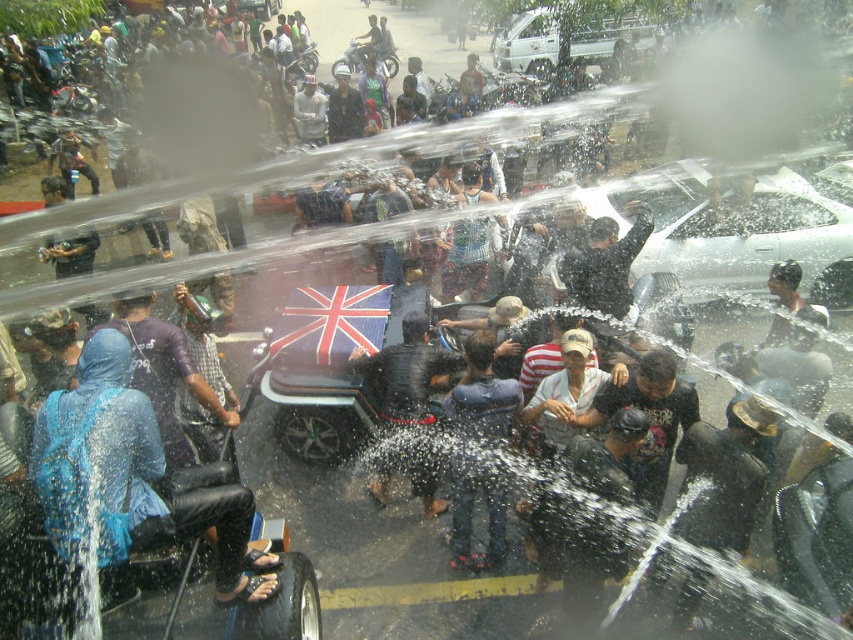
Question: Is blue fabric umbrella at left thinner than dark blue jeans at center?

Choices:
 (A) no
 (B) yes

Answer: (A)

Question: Is blue fabric umbrella at left to the left of dark blue jeans at center from the viewer's perspective?

Choices:
 (A) yes
 (B) no

Answer: (A)

Question: Is blue fabric umbrella at left thinner than dark blue jeans at center?

Choices:
 (A) no
 (B) yes

Answer: (A)

Question: Which object is farther from the camera taking this photo?

Choices:
 (A) blue fabric umbrella at left
 (B) dark blue fabric umbrella at center
 (C) dark blue jeans at center

Answer: (B)

Question: Among these points, which one is farthest from the camera?

Choices:
 (A) (370, 493)
 (B) (119, 484)
 (C) (473, 376)

Answer: (A)

Question: Which point is farther to the camera?

Choices:
 (A) dark blue fabric umbrella at center
 (B) dark blue jeans at center

Answer: (A)